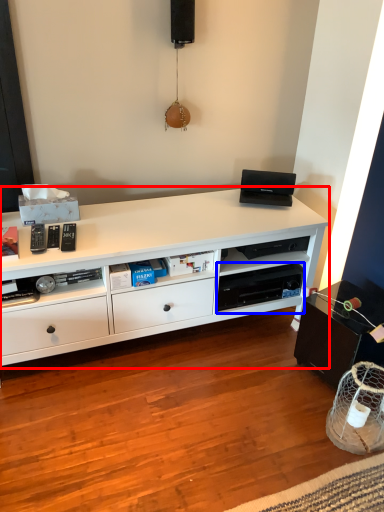
Question: Which object is further to the camera taking this photo, desk (highlighted by a red box) or shelf (highlighted by a blue box)?

Choices:
 (A) desk
 (B) shelf

Answer: (B)